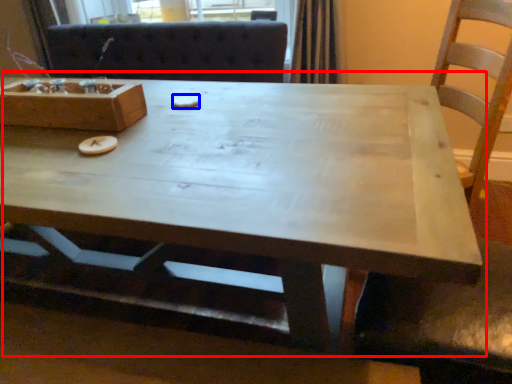
Question: Which object is closer to the camera taking this photo, coffee table (highlighted by a red box) or food (highlighted by a blue box)?

Choices:
 (A) coffee table
 (B) food

Answer: (A)